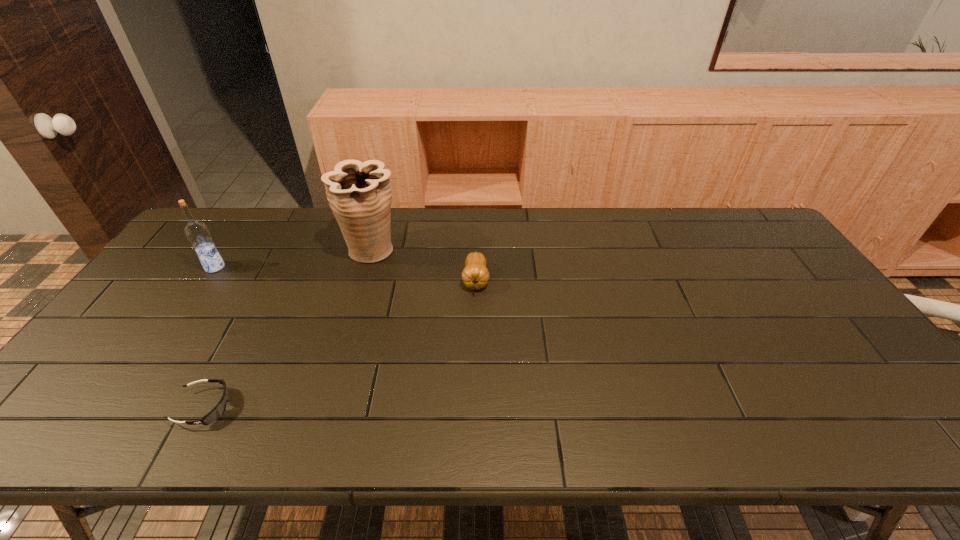
Locate an element on the screen. This screenshot has width=960, height=540. object that is at the far edge is located at coordinates (359, 194).

Where is `object that is at the near edge`? The image size is (960, 540). object that is at the near edge is located at coordinates (219, 409).

The height and width of the screenshot is (540, 960). Find the location of `object positioned at the left edge`. object positioned at the left edge is located at coordinates (197, 232).

Identify the location of vacant space at the far edge of the desktop. This screenshot has width=960, height=540. (314, 234).

The width and height of the screenshot is (960, 540). Identify the location of free space at the near edge of the desktop. (570, 437).

What are the coordinates of `vacant region at the left edge` in the screenshot? It's located at (108, 402).

Identify the location of vacant space at the right edge. (746, 265).

In the image, there is a desktop. At what (x,y) coordinates should I click in order to perform the action: click on vacant space at the far left corner. Please return your answer as a coordinate pair (x, y). Image resolution: width=960 pixels, height=540 pixels. Looking at the image, I should click on (219, 242).

Where is `vacant space at the far right corner of the desktop`? The width and height of the screenshot is (960, 540). vacant space at the far right corner of the desktop is located at coordinates (749, 219).

Where is `vacant space at the near right corner of the desktop`? vacant space at the near right corner of the desktop is located at coordinates (914, 426).